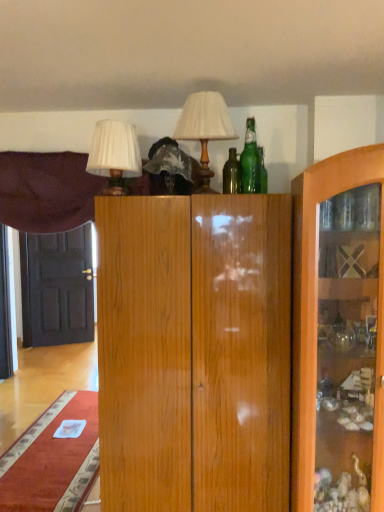
Question: Considering the relative positions of velvet purple curtain at upper left and black glossy door at left in the image provided, is velvet purple curtain at upper left to the left of black glossy door at left from the viewer's perspective?

Choices:
 (A) yes
 (B) no

Answer: (B)

Question: Does velvet purple curtain at upper left have a smaller size compared to black glossy door at left?

Choices:
 (A) no
 (B) yes

Answer: (A)

Question: Can you confirm if velvet purple curtain at upper left is bigger than black glossy door at left?

Choices:
 (A) yes
 (B) no

Answer: (A)

Question: From the image's perspective, does velvet purple curtain at upper left appear higher than black glossy door at left?

Choices:
 (A) yes
 (B) no

Answer: (A)

Question: Is velvet purple curtain at upper left not near black glossy door at left?

Choices:
 (A) yes
 (B) no

Answer: (A)

Question: Based on their sizes in the image, would you say velvet purple curtain at upper left is bigger or smaller than matte white lampshade at upper center, arranged as the 2th table lamp when viewed from the left?

Choices:
 (A) big
 (B) small

Answer: (A)

Question: Is velvet purple curtain at upper left taller or shorter than matte white lampshade at upper center, the 1th table lamp positioned from the right?

Choices:
 (A) tall
 (B) short

Answer: (A)

Question: From the image's perspective, relative to matte white lampshade at upper center, the 1th table lamp positioned from the right, is velvet purple curtain at upper left above or below?

Choices:
 (A) above
 (B) below

Answer: (B)

Question: Does point (1, 207) appear closer or farther from the camera than point (230, 134)?

Choices:
 (A) closer
 (B) farther

Answer: (B)

Question: Is black glossy door at left in front of or behind velvet purple curtain at upper left in the image?

Choices:
 (A) front
 (B) behind

Answer: (B)

Question: Choose the correct answer: Is black glossy door at left inside velvet purple curtain at upper left or outside it?

Choices:
 (A) outside
 (B) inside

Answer: (A)

Question: In terms of height, does black glossy door at left look taller or shorter compared to velvet purple curtain at upper left?

Choices:
 (A) tall
 (B) short

Answer: (A)

Question: From a real-world perspective, relative to velvet purple curtain at upper left, is black glossy door at left vertically above or below?

Choices:
 (A) below
 (B) above

Answer: (A)

Question: In the image, is matte white lampshade at upper center, the 1th table lamp positioned from the right, positioned in front of or behind white pleated shade at upper left, which appears as the first table lamp when viewed from the left?

Choices:
 (A) behind
 (B) front

Answer: (A)

Question: Is matte white lampshade at upper center, arranged as the 2th table lamp when viewed from the left, inside or outside of white pleated shade at upper left, which is the 2th table lamp from right to left?

Choices:
 (A) inside
 (B) outside

Answer: (B)